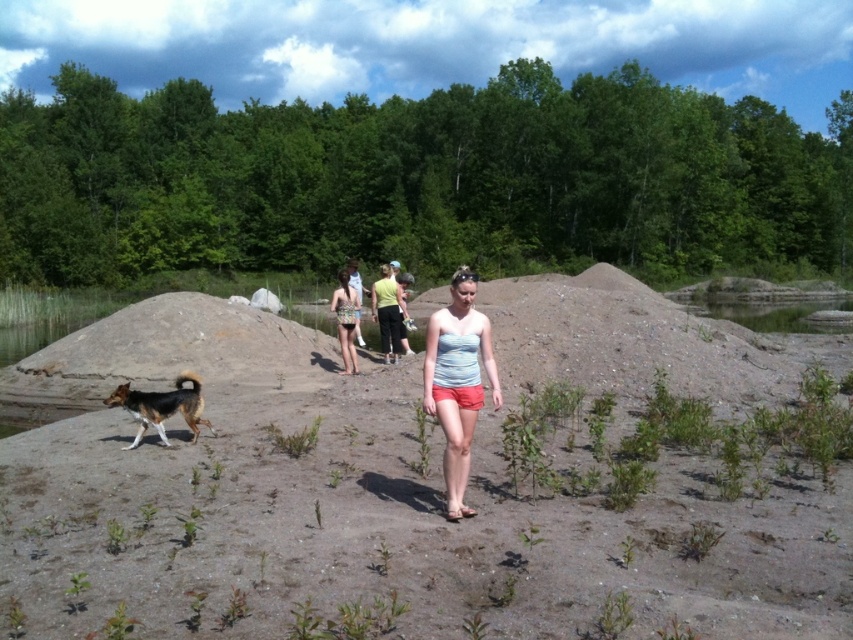
Who is positioned more to the left, light blue fabric top at center or brown and black fur dog at lower left?

brown and black fur dog at lower left

Is light blue fabric top at center above brown and black fur dog at lower left?

Correct, light blue fabric top at center is located above brown and black fur dog at lower left.

Which is in front, point (456, 332) or point (198, 388)?

Point (456, 332) is more forward.

You are a GUI agent. You are given a task and a screenshot of the screen. Output one action in this format:
    pyautogui.click(x=<x>, y=<y>)
    Task: Click on the light blue fabric top at center
    
    Given the screenshot: What is the action you would take?
    457,381

Does brown sandy soil at center appear on the right side of brown and black fur dog at lower left?

Yes, brown sandy soil at center is to the right of brown and black fur dog at lower left.

Can you confirm if brown sandy soil at center is positioned above brown and black fur dog at lower left?

Correct, brown sandy soil at center is located above brown and black fur dog at lower left.

Is point (675, 506) positioned behind point (136, 440)?

No.

I want to click on brown sandy soil at center, so click(x=426, y=481).

Does brown and black fur dog at lower left come behind patterned swimsuit at center?

No, it is not.

Who is taller, brown and black fur dog at lower left or patterned swimsuit at center?

Standing taller between the two is patterned swimsuit at center.

Who is more forward, (x=198, y=380) or (x=349, y=317)?

Positioned in front is point (x=198, y=380).

Find the location of a particular element. brown and black fur dog at lower left is located at coordinates (161, 406).